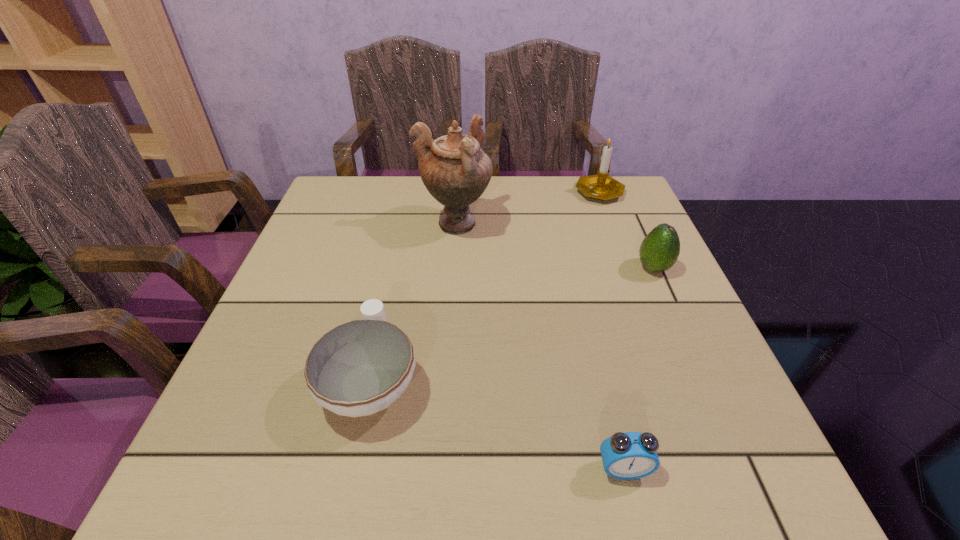
At what (x,y) coordinates should I click in order to perform the action: click on urn. Please return your answer as a coordinate pair (x, y). Looking at the image, I should click on (455, 170).

Find the location of a particular element. The width and height of the screenshot is (960, 540). the second tallest object is located at coordinates (601, 186).

Find the location of a particular element. avocado is located at coordinates (659, 250).

I want to click on the third nearest object, so click(x=659, y=250).

Find the location of `chinaware`. chinaware is located at coordinates (359, 368).

The image size is (960, 540). I want to click on alarm clock, so click(625, 455).

You are a GUI agent. You are given a task and a screenshot of the screen. Output one action in this format:
    pyautogui.click(x=<x>, y=<y>)
    Task: Click on the nearest object
    
    Given the screenshot: What is the action you would take?
    pyautogui.click(x=625, y=455)

This screenshot has width=960, height=540. Identify the location of free location located on the right of the urn. (535, 224).

In order to click on free spot located on the front of the second tallest object in this screenshot , I will do `click(618, 242)`.

Where is `vacant space situated on the left of the third farthest object`? The width and height of the screenshot is (960, 540). vacant space situated on the left of the third farthest object is located at coordinates (539, 268).